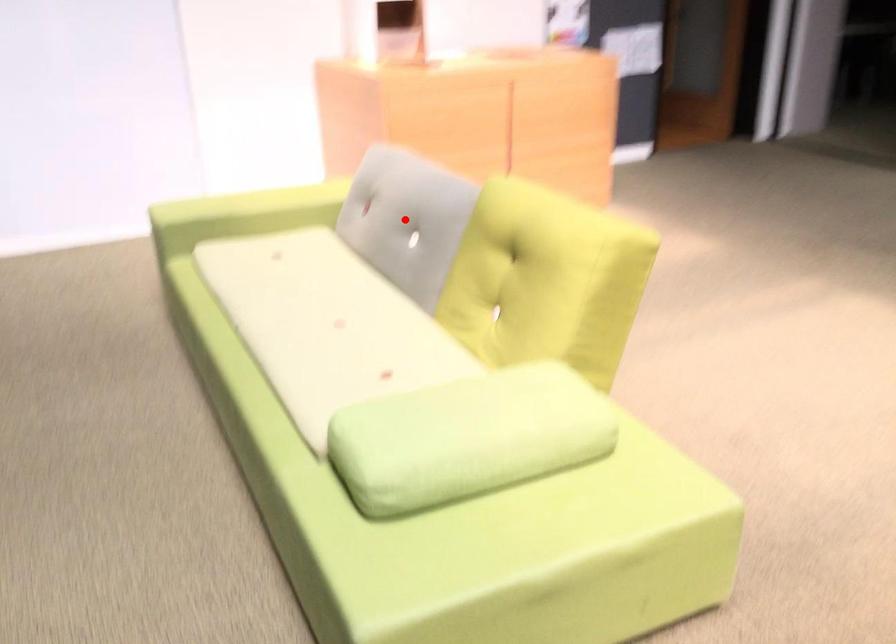
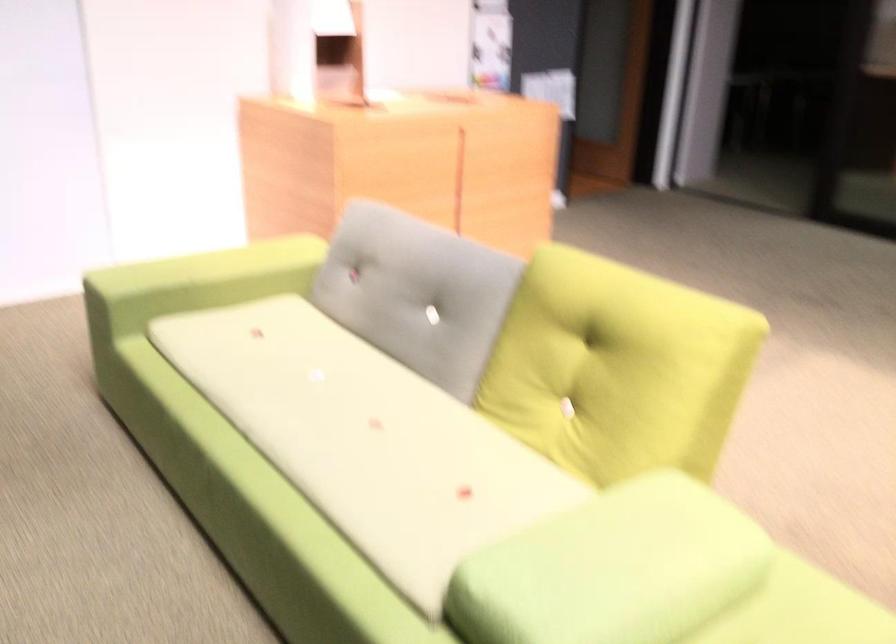
Question: I am providing you with two images of the same scene from different viewpoints. Image1 has a red point marked. In image2, the corresponding 3D location appears at what relative position? Reply with the corresponding letter.

Choices:
 (A) Closer
 (B) Farther

Answer: (A)